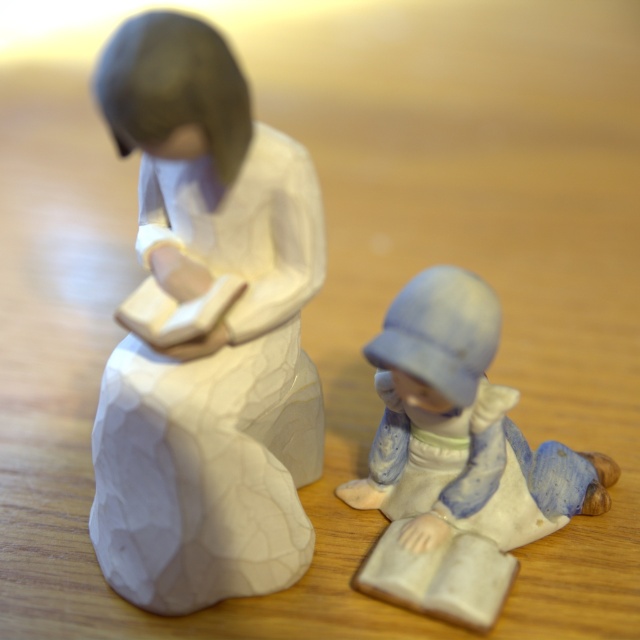
Question: Does white glossy statue at left appear on the left side of porcelain figure at lower right?

Choices:
 (A) yes
 (B) no

Answer: (A)

Question: Does white glossy statue at left appear under porcelain figure at lower right?

Choices:
 (A) no
 (B) yes

Answer: (A)

Question: Which object is closer to the camera taking this photo?

Choices:
 (A) porcelain figure at lower right
 (B) white glossy statue at left

Answer: (B)

Question: Can you confirm if white glossy statue at left is positioned to the left of porcelain figure at lower right?

Choices:
 (A) no
 (B) yes

Answer: (B)